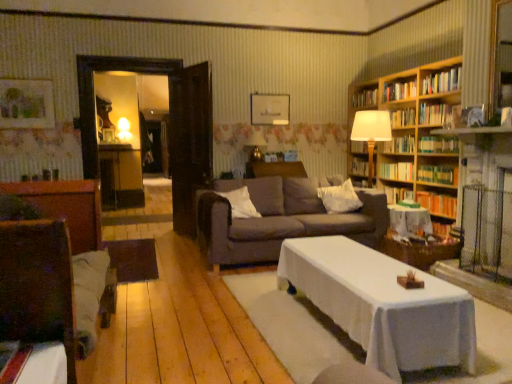
Locate an element on the screen. This screenshot has height=384, width=512. hardcover book at upper right, the seventh book positioned from the bottom is located at coordinates (399, 145).

This screenshot has height=384, width=512. Find the location of `wooden basket at lower right`. wooden basket at lower right is located at coordinates (422, 248).

The image size is (512, 384). In order to click on matte white picture frame at upper center in this screenshot , I will do `click(269, 109)`.

From a real-world perspective, which is physically above, wooden swivel chair at left or hardcover books at upper right, the eighth book ordered from the bottom?

From a 3D spatial view, hardcover books at upper right, the eighth book ordered from the bottom, is above.

In order to click on swivel chair below the hardcover books at upper right, the eighth book ordered from the bottom (from the image's perspective) in this screenshot , I will do [x=37, y=285].

Can you confirm if wooden swivel chair at left is smaller than hardcover books at upper right, which is the fourth book in top-to-bottom order?

No, wooden swivel chair at left is not smaller than hardcover books at upper right, which is the fourth book in top-to-bottom order.

Which object is more forward, wooden swivel chair at left or hardcover books at upper right, the eighth book ordered from the bottom?

Positioned in front is wooden swivel chair at left.

Can hardcover book at upper right, the 5th book viewed from the top, be found inside hardcover book at upper right, arranged as the fifth book when ordered from the bottom?

No, hardcover book at upper right, arranged as the fifth book when ordered from the bottom, does not contain hardcover book at upper right, the 5th book viewed from the top.

Can you tell me how much hardcover book at upper right, arranged as the fifth book when ordered from the bottom, and hardcover book at upper right, the seventh book positioned from the bottom, differ in facing direction?

0.00188 degrees separate the facing orientations of hardcover book at upper right, arranged as the fifth book when ordered from the bottom, and hardcover book at upper right, the seventh book positioned from the bottom.

You are a GUI agent. You are given a task and a screenshot of the screen. Output one action in this format:
    pyautogui.click(x=<x>, y=<y>)
    Task: Click on the book that is the 2nd object located below the hardcover book at upper right, the seventh book positioned from the bottom (from the image's perspective)
    The height and width of the screenshot is (384, 512).
    Given the screenshot: What is the action you would take?
    pyautogui.click(x=362, y=167)

From the image's perspective, is hardcover book at upper right, arranged as the fifth book when ordered from the bottom, located above hardcover book at upper right, the 5th book viewed from the top?

No, from the image's perspective, hardcover book at upper right, arranged as the fifth book when ordered from the bottom, is not over hardcover book at upper right, the 5th book viewed from the top.

Considering the sizes of objects hardcover books at upper right, the 2th book viewed from the top, and matte yellow lampshade at upper left, positioned as the 1th lamp in back-to-front order, in the image provided, who is shorter, hardcover books at upper right, the 2th book viewed from the top, or matte yellow lampshade at upper left, positioned as the 1th lamp in back-to-front order,?

Standing shorter between the two is hardcover books at upper right, the 2th book viewed from the top.

From a real-world perspective, does hardcover books at upper right, the tenth book from the bottom, sit lower than matte yellow lampshade at upper left, which ranks as the 2th lamp in right-to-left order?

Actually, hardcover books at upper right, the tenth book from the bottom, is physically above matte yellow lampshade at upper left, which ranks as the 2th lamp in right-to-left order, in the real world.

Is hardcover books at upper right, the tenth book from the bottom, looking in the opposite direction of matte yellow lampshade at upper left, positioned as the 1th lamp in back-to-front order?

No.

Where is `the 2nd lamp counting from the left of the hardcover books at upper right, the 2th book viewed from the top`? The image size is (512, 384). the 2nd lamp counting from the left of the hardcover books at upper right, the 2th book viewed from the top is located at coordinates (124, 130).

Which of these two, hardcover books at center right, which is counted as the first book, starting from the bottom, or hardcover book at upper right, the 1th book viewed from the top, stands taller?

hardcover book at upper right, the 1th book viewed from the top.

From the image's perspective, relative to hardcover book at upper right, placed as the 11th book when sorted from bottom to top, is hardcover books at center right, which ranks as the 11th book in top-to-bottom order, above or below?

hardcover books at center right, which ranks as the 11th book in top-to-bottom order, is below hardcover book at upper right, placed as the 11th book when sorted from bottom to top.

Where is `the 5th book in front of the hardcover book at upper right, placed as the 11th book when sorted from bottom to top`? The height and width of the screenshot is (384, 512). the 5th book in front of the hardcover book at upper right, placed as the 11th book when sorted from bottom to top is located at coordinates (437, 203).

Are hardcover books at center right, which ranks as the 11th book in top-to-bottom order, and hardcover book at upper right, placed as the 11th book when sorted from bottom to top, located far from each other?

Yes, hardcover books at center right, which ranks as the 11th book in top-to-bottom order, and hardcover book at upper right, placed as the 11th book when sorted from bottom to top, are located far from each other.

Between hardcover book at center, arranged as the 10th book when viewed from the top, and white soft pillow at center, marked as the 1th pillow in a left-to-right arrangement, which one appears on the right side from the viewer's perspective?

hardcover book at center, arranged as the 10th book when viewed from the top, is more to the right.

How many degrees apart are the facing directions of hardcover book at center, placed as the second book when sorted from bottom to top, and white soft pillow at center, marked as the 1th pillow in a left-to-right arrangement?

The angular difference between hardcover book at center, placed as the second book when sorted from bottom to top, and white soft pillow at center, marked as the 1th pillow in a left-to-right arrangement, is 88.9 degrees.

Looking at the image, does hardcover book at center, arranged as the 10th book when viewed from the top, seem bigger or smaller compared to white soft pillow at center, placed as the second pillow when sorted from right to left?

hardcover book at center, arranged as the 10th book when viewed from the top, is smaller than white soft pillow at center, placed as the second pillow when sorted from right to left.

Looking at this image, does hardcover book at center, placed as the second book when sorted from bottom to top, turn towards white soft pillow at center, marked as the 1th pillow in a left-to-right arrangement?

Yes, hardcover book at center, placed as the second book when sorted from bottom to top, faces towards white soft pillow at center, marked as the 1th pillow in a left-to-right arrangement.

Is hardcover books at upper right, which appears as the ninth book when ordered from the bottom, outside of hardcover book at upper right, the 5th book viewed from the top?

Absolutely, hardcover books at upper right, which appears as the ninth book when ordered from the bottom, is external to hardcover book at upper right, the 5th book viewed from the top.

From the image's perspective, does hardcover books at upper right, the 3th book viewed from the top, appear lower than hardcover book at upper right, the seventh book positioned from the bottom?

Actually, hardcover books at upper right, the 3th book viewed from the top, appears above hardcover book at upper right, the seventh book positioned from the bottom, in the image.

Considering the sizes of objects hardcover books at upper right, which appears as the ninth book when ordered from the bottom, and hardcover book at upper right, the 5th book viewed from the top, in the image provided, who is thinner, hardcover books at upper right, which appears as the ninth book when ordered from the bottom, or hardcover book at upper right, the 5th book viewed from the top,?

With smaller width is hardcover books at upper right, which appears as the ninth book when ordered from the bottom.

Which is correct: hardcover book at upper right, the 5th book viewed from the top, is inside hardcover books at upper right, the eighth book ordered from the bottom, or outside of it?

hardcover book at upper right, the 5th book viewed from the top, is located beyond the bounds of hardcover books at upper right, the eighth book ordered from the bottom.

From a real-world perspective, does hardcover book at upper right, the 5th book viewed from the top, stand above hardcover books at upper right, which is the fourth book in top-to-bottom order?

Incorrect, from a real-world perspective, hardcover book at upper right, the 5th book viewed from the top, is lower than hardcover books at upper right, which is the fourth book in top-to-bottom order.

This screenshot has width=512, height=384. I want to click on book that is the 4th one when counting rightward from the hardcover book at upper right, the 5th book viewed from the top, so click(x=438, y=114).

This screenshot has width=512, height=384. In order to click on swivel chair beneath the hardcover books at upper right, which is the fourth book in top-to-bottom order (from a real-world perspective) in this screenshot , I will do `click(37, 285)`.

In order to click on the 2nd book above the hardcover book at upper right, which is counted as the seventh book, starting from the top (from the image's perspective) in this screenshot , I will do coord(399,145).

From the image, which object appears to be nearer to white cloth-covered table at center, hardcover book at center, arranged as the 10th book when viewed from the top, or wooden bookshelf at right?

Based on the image, hardcover book at center, arranged as the 10th book when viewed from the top, appears to be nearer to white cloth-covered table at center.

Looking at the image, which one is located further to green hardcover book at right, which is the 9th book from top to bottom, wooden basket at lower right or wooden swivel chair at left?

wooden swivel chair at left is further to green hardcover book at right, which is the 9th book from top to bottom.

Looking at the image, which one is located further to hardcover book at upper right, which appears as the 6th book when ordered from the bottom, hardcover book at upper right, placed as the 11th book when sorted from bottom to top, or hardcover books at center right, which is counted as the first book, starting from the bottom?

hardcover book at upper right, placed as the 11th book when sorted from bottom to top, is further to hardcover book at upper right, which appears as the 6th book when ordered from the bottom.

From the image, which object appears to be farther from matte white picture frame at upper center, hardcover books at upper right, the tenth book from the bottom, or hardcover book at upper right, placed as the 11th book when sorted from bottom to top?

hardcover books at upper right, the tenth book from the bottom, lies further to matte white picture frame at upper center than the other object.

Based on their spatial positions, is hardcover book at upper right, which appears as the 6th book when ordered from the bottom, or dark brown fabric couch at center closer to gold metallic lamp at upper center, the first lamp when ordered from bottom to top?

Among the two, dark brown fabric couch at center is located nearer to gold metallic lamp at upper center, the first lamp when ordered from bottom to top.

Considering their positions, is hardcover books at upper right, the 2th book viewed from the top, positioned closer to hardcover book at upper right, which is counted as the seventh book, starting from the top, than hardcover books at upper right, which is the fourth book in top-to-bottom order?

The object closer to hardcover book at upper right, which is counted as the seventh book, starting from the top, is hardcover books at upper right, which is the fourth book in top-to-bottom order.

When comparing their distances from matte white picture frame at upper center, does hardcover book at center, placed as the second book when sorted from bottom to top, or white soft pillow at center, the 1th pillow from the right, seem closer?

Among the two, white soft pillow at center, the 1th pillow from the right, is located nearer to matte white picture frame at upper center.

Considering their positions, is hardcover books at upper right, the tenth book from the bottom, positioned further to hardcover book at upper right, the seventh book positioned from the bottom, than green hardcover book at right, which is the 9th book from top to bottom?

hardcover books at upper right, the tenth book from the bottom, lies further to hardcover book at upper right, the seventh book positioned from the bottom, than the other object.

Where is `table located between white soft pillow at center, marked as the 1th pillow in a left-to-right arrangement, and wooden basket at lower right in the left-right direction`? table located between white soft pillow at center, marked as the 1th pillow in a left-to-right arrangement, and wooden basket at lower right in the left-right direction is located at coordinates (409, 220).

Find the location of `book between white soft pillow at center, marked as the 1th pillow in a left-to-right arrangement, and hardcover book at upper right, arranged as the fifth book when ordered from the bottom, in the horizontal direction`. book between white soft pillow at center, marked as the 1th pillow in a left-to-right arrangement, and hardcover book at upper right, arranged as the fifth book when ordered from the bottom, in the horizontal direction is located at coordinates (364, 98).

I want to click on bookcase between wooden swivel chair at left and hardcover book at upper right, the sixth book when ordered from top to bottom, from front to back, so click(x=419, y=131).

The image size is (512, 384). Find the location of `lamp located between wooden basket at lower right and hardcover book at upper right, placed as the 11th book when sorted from bottom to top, in the depth direction`. lamp located between wooden basket at lower right and hardcover book at upper right, placed as the 11th book when sorted from bottom to top, in the depth direction is located at coordinates (255, 146).